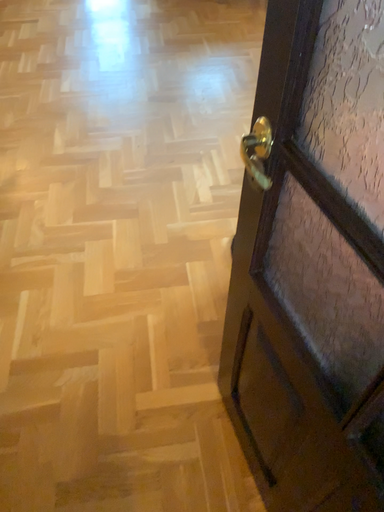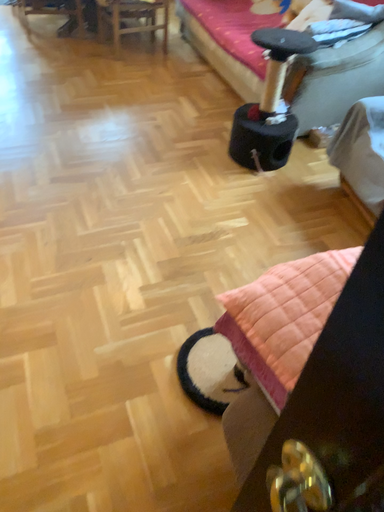
Question: How did the camera likely rotate when shooting the video?

Choices:
 (A) rotated right
 (B) rotated left

Answer: (A)